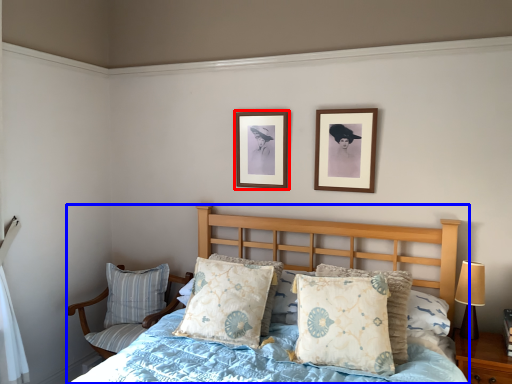
Question: Which object is closer to the camera taking this photo, picture frame (highlighted by a red box) or bed (highlighted by a blue box)?

Choices:
 (A) picture frame
 (B) bed

Answer: (B)